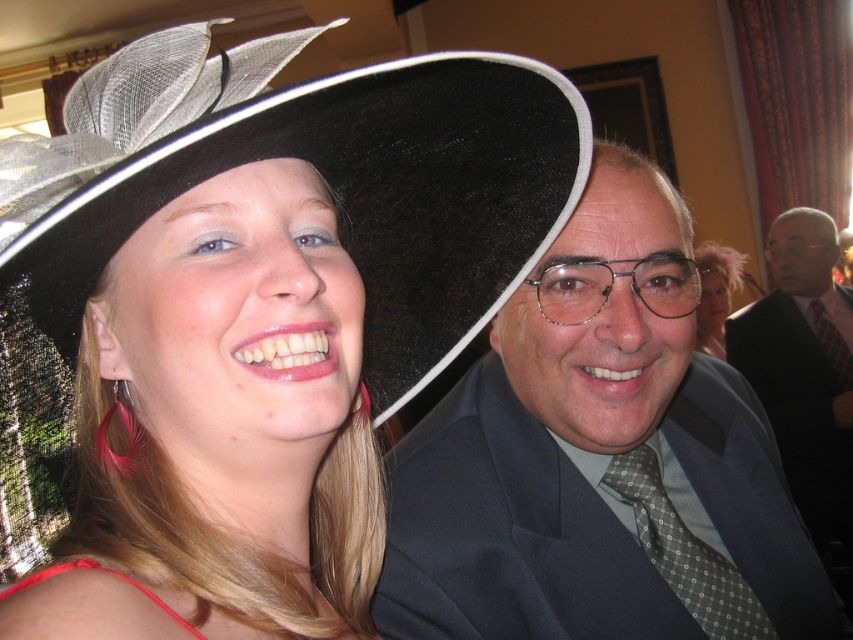
You are a photographer at a formal event. You need to adjust the lighting to ensure both the matte black hat at center and the black felt hat at upper left are well lit. Which hat requires more light because it is larger?

The matte black hat at center requires more light because it is larger than the black felt hat at upper left.

You are standing in the room where the two people are posing. You want to place a small decoration between the two points, point (642, 468) and point (708, 273). Which point should the decoration be closer to in order to be centered between them?

The decoration should be closer to point (708, 273) because point (642, 468) is in front of point (708, 273), so the midpoint would be closer to the point that is further back.